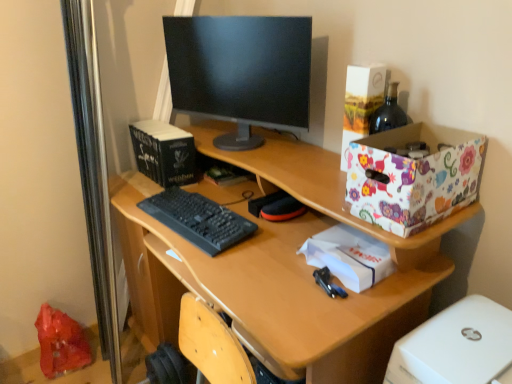
Question: Considering the positions of black matte keyboard at center and floral paper box at upper right in the image, is black matte keyboard at center bigger or smaller than floral paper box at upper right?

Choices:
 (A) big
 (B) small

Answer: (B)

Question: Considering the positions of black matte keyboard at center and floral paper box at upper right in the image, is black matte keyboard at center wider or thinner than floral paper box at upper right?

Choices:
 (A) thin
 (B) wide

Answer: (B)

Question: Which of these objects is positioned closest to the black matte keyboard at center?

Choices:
 (A) wooden desk at center
 (B) black matte book at upper left, the 2th book viewed from the right
 (C) shiny plastic bag at lower left
 (D) white paper at center
 (E) hardcover book at center, arranged as the second book when viewed from the left

Answer: (A)

Question: Which of these objects is positioned farthest from the white paper at center?

Choices:
 (A) wooden desk at center
 (B) black glossy monitor at center
 (C) black matte keyboard at center
 (D) shiny plastic bag at lower left
 (E) hardcover book at center, placed as the first book when sorted from right to left

Answer: (D)